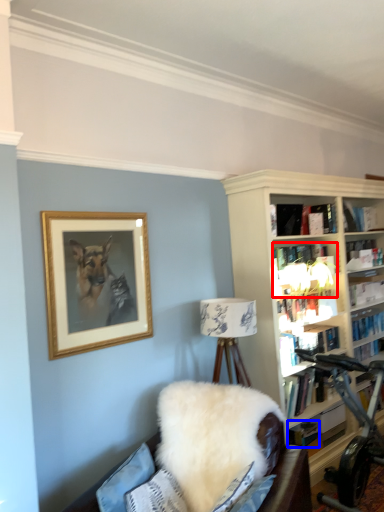
Question: Which object appears farthest to the camera in this image, book (highlighted by a red box) or book (highlighted by a blue box)?

Choices:
 (A) book
 (B) book

Answer: (B)